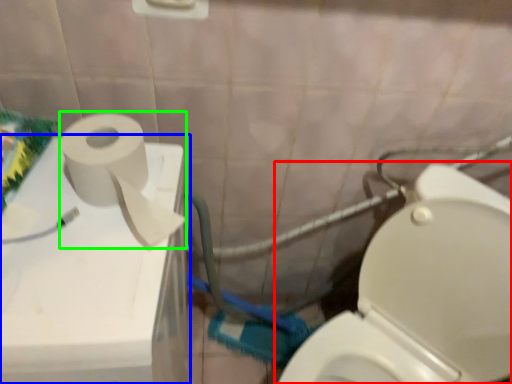
Question: Which is nearer to the toilet (highlighted by a red box)? appliance (highlighted by a blue box) or toiletry paper (highlighted by a green box).

Choices:
 (A) appliance
 (B) toiletry paper

Answer: (A)